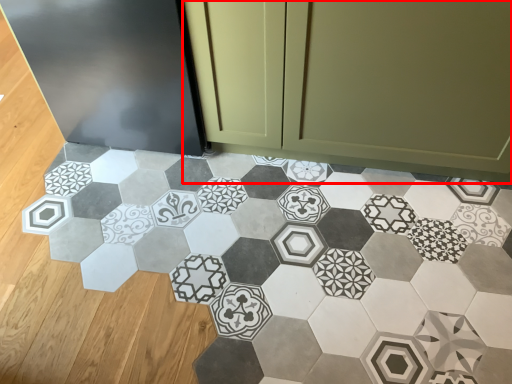
Question: From the image, what is the correct spatial relationship of cabinetry (annotated by the red box) in relation to ceramic tile?

Choices:
 (A) right
 (B) left

Answer: (A)